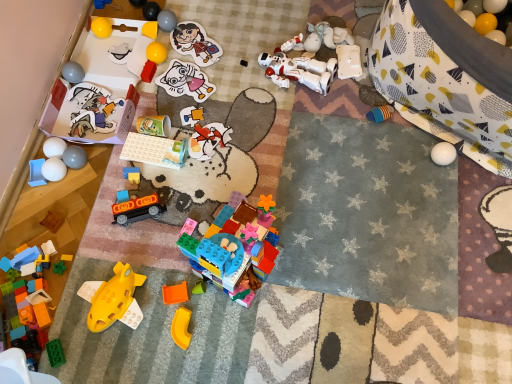
Identify the location of free space in front of matte paper sticker at center, the seventh toy viewed from the right. The image size is (512, 384). (195, 127).